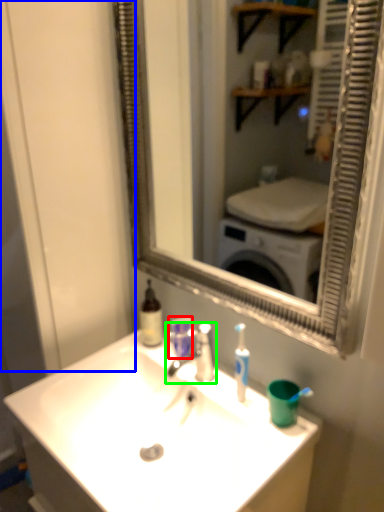
Question: Which object is the closest to the mouthwash (highlighted by a red box)? Choose among these: glass door (highlighted by a blue box) or tap (highlighted by a green box).

Choices:
 (A) glass door
 (B) tap

Answer: (B)